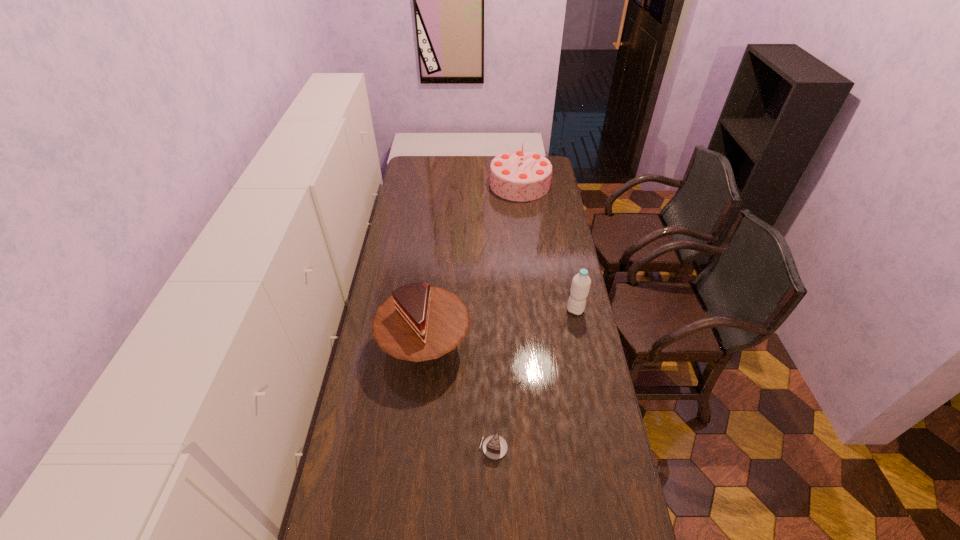
At what (x,y) coordinates should I click in order to perform the action: click on empty location between the cake and the water bottle. Please return your answer as a coordinate pair (x, y). Image resolution: width=960 pixels, height=540 pixels. Looking at the image, I should click on (500, 327).

Identify the location of empty space that is in between the water bottle and the chocolate cake. (535, 379).

You are a GUI agent. You are given a task and a screenshot of the screen. Output one action in this format:
    pyautogui.click(x=<x>, y=<y>)
    Task: Click on the vacant point located between the farthest object and the cake
    
    Given the screenshot: What is the action you would take?
    pyautogui.click(x=472, y=264)

This screenshot has height=540, width=960. Identify the location of free area in between the water bottle and the cake. tap(500, 327).

The width and height of the screenshot is (960, 540). In order to click on vacant point located between the water bottle and the cake in this screenshot , I will do point(500,327).

Image resolution: width=960 pixels, height=540 pixels. Find the location of `vacant area between the water bottle and the birthday cake`. vacant area between the water bottle and the birthday cake is located at coordinates (547, 247).

Locate an element on the screen. free point between the water bottle and the nearest object is located at coordinates (535, 379).

Find the location of `the third closest object to the cake`. the third closest object to the cake is located at coordinates (519, 175).

Choose which object is the third nearest neighbor to the cake. Please provide its 2D coordinates. Your answer should be formatted as a tuple, i.e. [(x, y)], where the tuple contains the x and y coordinates of a point satisfying the conditions above.

[(519, 175)]

Locate an element on the screen. vacant area in the image that satisfies the following two spatial constraints: 1. on the front side of the water bottle; 2. on the left side of the birthday cake is located at coordinates (535, 310).